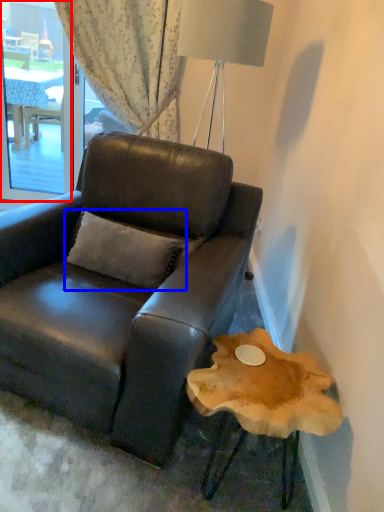
Question: Which point is closer to the camera, window screen (highlighted by a red box) or pillow (highlighted by a blue box)?

Choices:
 (A) window screen
 (B) pillow

Answer: (B)